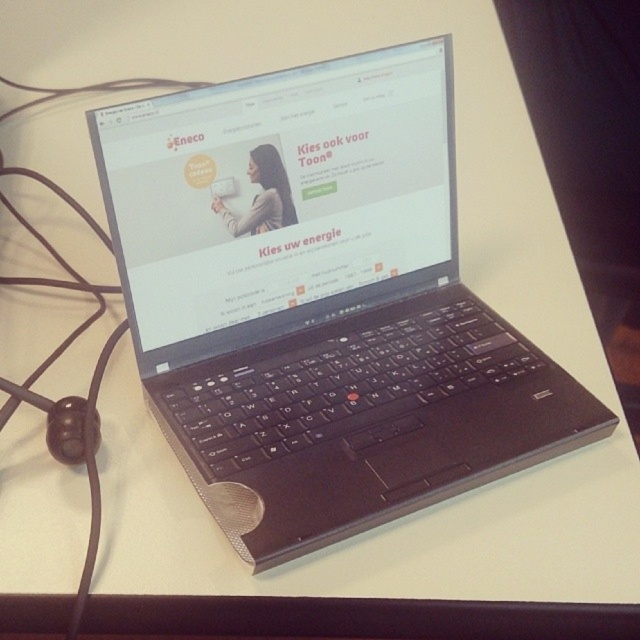
Which is more to the left, matte plastic woman at center or white matte text at center?

matte plastic woman at center is more to the left.

Can you confirm if matte plastic woman at center is shorter than white matte text at center?

No, matte plastic woman at center is not shorter than white matte text at center.

At what (x,y) coordinates should I click in order to perform the action: click on matte plastic woman at center. Please return your answer as a coordinate pair (x, y). This screenshot has width=640, height=640. Looking at the image, I should click on (260, 196).

Looking at this image, does black plastic laptop at center have a greater width compared to matte plastic woman at center?

Yes.

What are the coordinates of `black plastic laptop at center` in the screenshot? It's located at (321, 305).

At what (x,y) coordinates should I click in order to perform the action: click on black plastic laptop at center. Please return your answer as a coordinate pair (x, y). Looking at the image, I should click on (321, 305).

Between black plastic laptop at center and white matte text at center, which one has more height?

black plastic laptop at center is taller.

Does point (209, 451) come in front of point (314, 241)?

Yes.

Which is behind, point (538, 410) or point (296, 243)?

Positioned behind is point (296, 243).

At what (x,y) coordinates should I click in order to perform the action: click on black plastic laptop at center. Please return your answer as a coordinate pair (x, y). Looking at the image, I should click on (321, 305).